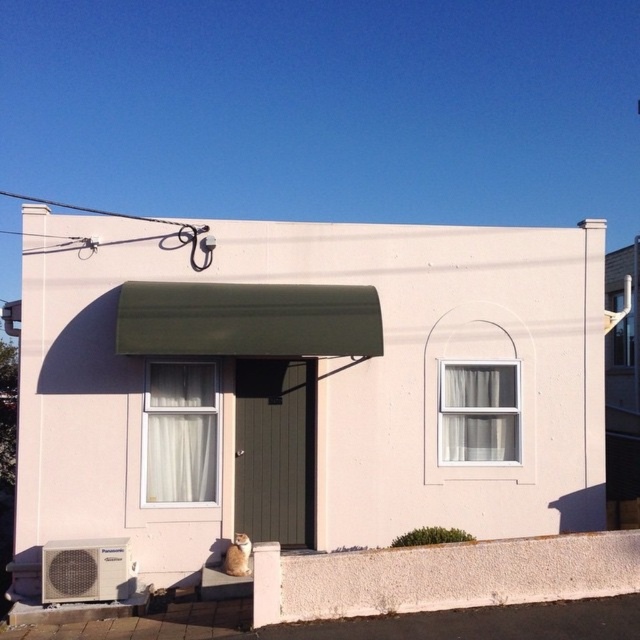
Question: Can you confirm if white matte shed at center is bigger than white sheer curtain at center?

Choices:
 (A) yes
 (B) no

Answer: (B)

Question: Which point is farther to the camera?

Choices:
 (A) (456, 419)
 (B) (176, 451)
 (C) (45, 449)

Answer: (A)

Question: Among these points, which one is farthest from the camera?

Choices:
 (A) (228, 317)
 (B) (209, 378)

Answer: (B)

Question: Which point appears farthest from the camera in this image?

Choices:
 (A) pyautogui.click(x=516, y=451)
 (B) pyautogui.click(x=195, y=403)
 (C) pyautogui.click(x=573, y=269)

Answer: (C)

Question: Does white matte shed at center appear on the right side of white sheer curtain at center?

Choices:
 (A) yes
 (B) no

Answer: (B)

Question: Can you confirm if white matte shed at center is positioned below white sheer curtain at center?

Choices:
 (A) yes
 (B) no

Answer: (B)